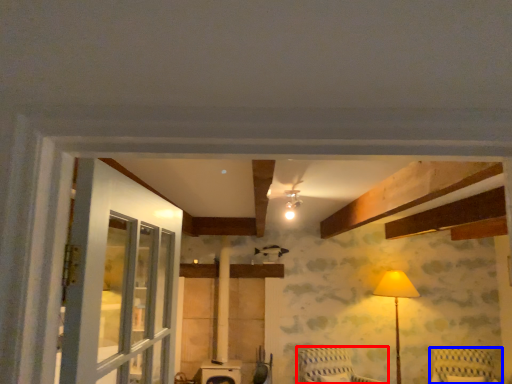
Question: Among these objects, which one is nearest to the camera, furniture (highlighted by a red box) or furniture (highlighted by a blue box)?

Choices:
 (A) furniture
 (B) furniture

Answer: (A)